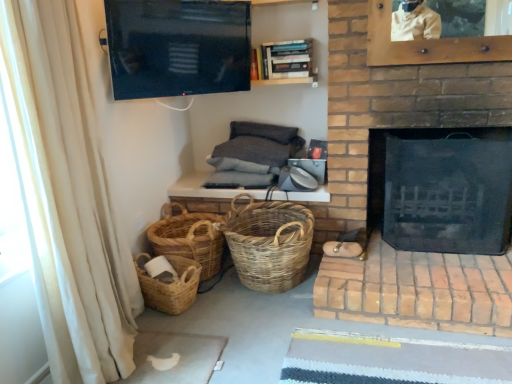
Question: Would you say wooden bookshelf at upper center is outside flat-screen tv at upper center?

Choices:
 (A) no
 (B) yes

Answer: (B)

Question: Does wooden bookshelf at upper center lie behind flat-screen tv at upper center?

Choices:
 (A) yes
 (B) no

Answer: (A)

Question: Considering the relative sizes of wooden bookshelf at upper center and flat-screen tv at upper center in the image provided, is wooden bookshelf at upper center thinner than flat-screen tv at upper center?

Choices:
 (A) yes
 (B) no

Answer: (B)

Question: Are wooden bookshelf at upper center and flat-screen tv at upper center making contact?

Choices:
 (A) yes
 (B) no

Answer: (B)

Question: From the image's perspective, is wooden bookshelf at upper center on top of flat-screen tv at upper center?

Choices:
 (A) yes
 (B) no

Answer: (A)

Question: From a real-world perspective, is flat-screen tv at upper center physically located above or below woven natural baskets at lower left, marked as the second basket in a left-to-right arrangement?

Choices:
 (A) above
 (B) below

Answer: (A)

Question: From the image's perspective, is flat-screen tv at upper center positioned above or below woven natural baskets at lower left, the second basket from the right?

Choices:
 (A) below
 (B) above

Answer: (B)

Question: Visually, is flat-screen tv at upper center positioned to the left or to the right of woven natural baskets at lower left, the second basket from the right?

Choices:
 (A) left
 (B) right

Answer: (B)

Question: Is flat-screen tv at upper center wider or thinner than woven natural baskets at lower left, the second basket from the right?

Choices:
 (A) thin
 (B) wide

Answer: (A)

Question: Considering the positions of point (198, 261) and point (265, 233), is point (198, 261) closer or farther from the camera than point (265, 233)?

Choices:
 (A) farther
 (B) closer

Answer: (B)

Question: Based on their positions, is woven natural baskets at lower left, marked as the second basket in a left-to-right arrangement, located to the left or right of woven natural basket at center, placed as the first basket when sorted from right to left?

Choices:
 (A) right
 (B) left

Answer: (B)

Question: Is woven natural baskets at lower left, the second basket from the right, bigger or smaller than woven natural basket at center, which appears as the 3th basket when viewed from the left?

Choices:
 (A) big
 (B) small

Answer: (B)

Question: From a real-world perspective, relative to woven natural basket at center, placed as the first basket when sorted from right to left, is woven natural baskets at lower left, marked as the second basket in a left-to-right arrangement, vertically above or below?

Choices:
 (A) below
 (B) above

Answer: (A)

Question: Considering the positions of beige fabric curtain at left and black mesh fireplace at right in the image, is beige fabric curtain at left taller or shorter than black mesh fireplace at right?

Choices:
 (A) tall
 (B) short

Answer: (A)

Question: Would you say beige fabric curtain at left is to the left or to the right of black mesh fireplace at right in the picture?

Choices:
 (A) right
 (B) left

Answer: (B)